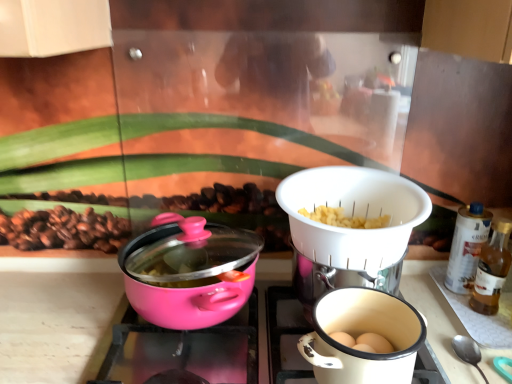
Question: Looking at the image, does translucent glass bottle at right seem bigger or smaller compared to matte white coffee cup at lower right?

Choices:
 (A) small
 (B) big

Answer: (A)

Question: Is translucent glass bottle at right spatially inside matte white coffee cup at lower right, or outside of it?

Choices:
 (A) inside
 (B) outside

Answer: (B)

Question: Which object is positioned closest to the pink matte pot at center, acting as the second kitchen appliance starting from the right?

Choices:
 (A) matte white coffee cup at lower right
 (B) pink glossy pot at center
 (C) translucent glass bottle at right
 (D) white plastic strainer at center, which is counted as the 1th kitchen appliance, starting from the right

Answer: (B)

Question: Which of these objects is positioned farthest from the pink matte pot at center, the first kitchen appliance when ordered from left to right?

Choices:
 (A) pink glossy pot at center
 (B) white plastic strainer at center, which is counted as the 1th kitchen appliance, starting from the right
 (C) matte white coffee cup at lower right
 (D) translucent glass bottle at right

Answer: (D)